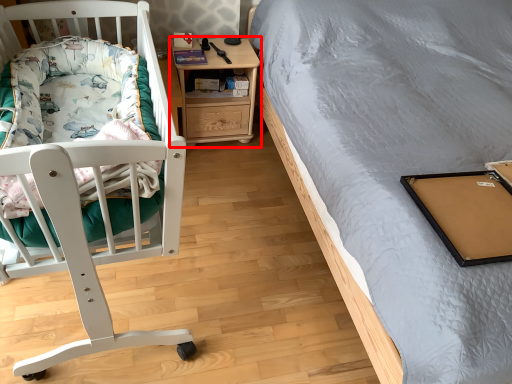
Question: From the image, what is the correct spatial relationship of nightstand (annotated by the red box) in relation to blanket?

Choices:
 (A) left
 (B) right

Answer: (B)